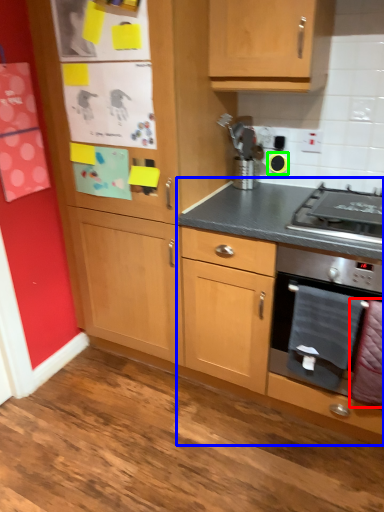
Question: Considering the real-world distances, which object is farthest from blanket (highlighted by a red box)? cabinetry (highlighted by a blue box) or appliance (highlighted by a green box)?

Choices:
 (A) cabinetry
 (B) appliance

Answer: (B)